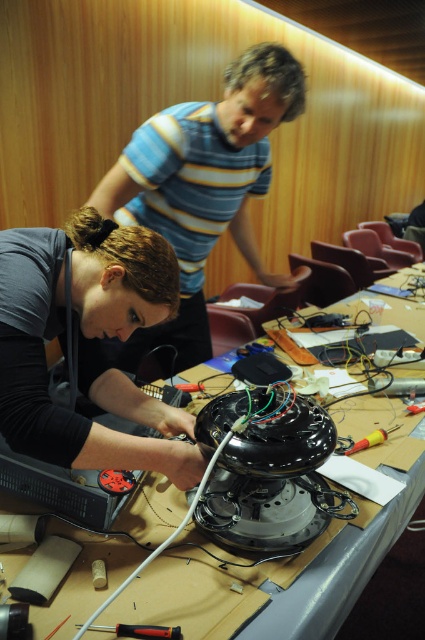
Can you confirm if striped cotton shirt at upper center is positioned above metallic screwdriver at lower center?

Correct, striped cotton shirt at upper center is located above metallic screwdriver at lower center.

Measure the distance between striped cotton shirt at upper center and camera.

A distance of 4.59 feet exists between striped cotton shirt at upper center and camera.

Does point (252, 141) come farther from viewer compared to point (138, 634)?

Yes, point (252, 141) is behind point (138, 634).

You are a GUI agent. You are given a task and a screenshot of the screen. Output one action in this format:
    pyautogui.click(x=<x>, y=<y>)
    Task: Click on the striped cotton shirt at upper center
    Image resolution: width=425 pixels, height=640 pixels.
    Given the screenshot: What is the action you would take?
    pyautogui.click(x=203, y=186)

Can you confirm if matte black hair at lower left is taller than yellow plastic screwdriver at center?

Yes.

Is matte black hair at lower left shorter than yellow plastic screwdriver at center?

No.

Is point (59, 266) in front of point (379, 442)?

Yes, it is in front of point (379, 442).

You are a GUI agent. You are given a task and a screenshot of the screen. Output one action in this format:
    pyautogui.click(x=<x>, y=<y>)
    Task: Click on the matte black hair at lower left
    
    Given the screenshot: What is the action you would take?
    pyautogui.click(x=87, y=344)

Between striped cotton shirt at upper center and yellow plastic screwdriver at center, which one has more height?

With more height is striped cotton shirt at upper center.

Does point (119, 156) come behind point (379, 432)?

Yes.

Locate an element on the screen. Image resolution: width=425 pixels, height=640 pixels. striped cotton shirt at upper center is located at coordinates (203, 186).